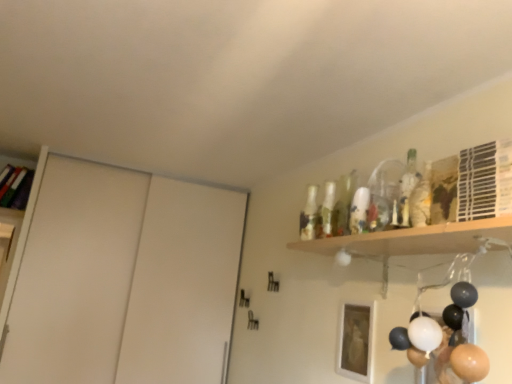
Describe the element at coordinates (485, 181) in the screenshot. I see `white plastic shelf at upper right, the second shelf in the back-to-front sequence` at that location.

From the picture: How much space does wooden bookshelf at upper left, which ranks as the second shelf in right-to-left order, occupy horizontally?

It is 12.65 inches.

What do you see at coordinates (16, 162) in the screenshot?
I see `wooden bookshelf at upper left, which ranks as the second shelf in right-to-left order` at bounding box center [16, 162].

The height and width of the screenshot is (384, 512). Find the location of `white matte sliding door at left`. white matte sliding door at left is located at coordinates (75, 275).

At what (x,y) coordinates should I click in order to perform the action: click on white matte picture frame at lower center. Please return your answer as a coordinate pair (x, y). This screenshot has width=512, height=384. Looking at the image, I should click on (356, 341).

At what (x,y) coordinates should I click in order to perform the action: click on white plastic shelf at upper right, which is the first shelf in right-to-left order. Please return your answer as a coordinate pair (x, y). Looking at the image, I should click on (485, 181).

From the image's perspective, is white matte picture frame at lower center below white matte sliding door at left?

Actually, white matte picture frame at lower center appears above white matte sliding door at left in the image.

How far apart are white matte picture frame at lower center and white matte sliding door at left?

white matte picture frame at lower center is 1.84 meters from white matte sliding door at left.

Considering the sizes of objects white matte picture frame at lower center and white matte sliding door at left in the image provided, who is wider, white matte picture frame at lower center or white matte sliding door at left?

With larger width is white matte sliding door at left.

Is white matte picture frame at lower center aimed at white matte sliding door at left?

Answer: No, white matte picture frame at lower center is not aimed at white matte sliding door at left.

From the image's perspective, does white matte sliding door at left appear lower than white matte picture frame at lower center?

Yes, from the image's perspective, white matte sliding door at left is below white matte picture frame at lower center.

Would you say white matte sliding door at left is inside or outside white matte picture frame at lower center?

white matte sliding door at left lies outside white matte picture frame at lower center.

Who is shorter, white matte sliding door at left or white matte picture frame at lower center?

With less height is white matte picture frame at lower center.

Considering the sizes of objects white matte sliding door at left and white matte picture frame at lower center in the image provided, who is smaller, white matte sliding door at left or white matte picture frame at lower center?

white matte picture frame at lower center is smaller.

From a real-world perspective, is wooden bookshelf at upper left, which ranks as the second shelf in right-to-left order, located higher than white plastic shelf at upper right, the second shelf in the back-to-front sequence?

Correct, in the physical world, wooden bookshelf at upper left, which ranks as the second shelf in right-to-left order, is higher than white plastic shelf at upper right, the second shelf in the back-to-front sequence.

Who is taller, wooden bookshelf at upper left, the 2th shelf viewed from the front, or white plastic shelf at upper right, which is the first shelf in right-to-left order?

wooden bookshelf at upper left, the 2th shelf viewed from the front, is taller.

Find the location of a particular element. Image resolution: width=512 pixels, height=384 pixels. shelf in front of the wooden bookshelf at upper left, positioned as the 1th shelf in back-to-front order is located at coordinates (485, 181).

Could you measure the distance between wooden bookshelf at upper left, positioned as the 1th shelf in back-to-front order, and white plastic shelf at upper right, the second shelf in the back-to-front sequence?

10.56 feet.

Locate an element on the screen. shelf below the wooden bookshelf at upper left, the 2th shelf viewed from the front (from a real-world perspective) is located at coordinates (485, 181).

Which object is closer to the camera, white plastic shelf at upper right, the second shelf in the back-to-front sequence, or wooden bookshelf at upper left, the 1th shelf viewed from the left?

white plastic shelf at upper right, the second shelf in the back-to-front sequence, is in front.

How much distance is there between white plastic shelf at upper right, which is counted as the 2th shelf, starting from the left, and wooden bookshelf at upper left, positioned as the 1th shelf in back-to-front order?

white plastic shelf at upper right, which is counted as the 2th shelf, starting from the left, is 10.56 feet from wooden bookshelf at upper left, positioned as the 1th shelf in back-to-front order.

Can wooden bookshelf at upper left, the 1th shelf viewed from the left, be found inside white plastic shelf at upper right, which is the first shelf in right-to-left order?

That's incorrect, wooden bookshelf at upper left, the 1th shelf viewed from the left, is not inside white plastic shelf at upper right, which is the first shelf in right-to-left order.

Measure the distance from white matte sliding door at left to matte black balloons at lower right.

They are 7.47 feet apart.

How many degrees apart are the facing directions of white matte sliding door at left and matte black balloons at lower right?

The angle between the facing direction of white matte sliding door at left and the facing direction of matte black balloons at lower right is 83.9 degrees.

Is white matte sliding door at left at the right side of matte black balloons at lower right?

No, white matte sliding door at left is not to the right of matte black balloons at lower right.

Considering the relative sizes of white matte sliding door at left and matte black balloons at lower right in the image provided, is white matte sliding door at left wider than matte black balloons at lower right?

Indeed, white matte sliding door at left has a greater width compared to matte black balloons at lower right.

From the image's perspective, is white plastic shelf at upper right, which is counted as the first shelf, starting from the front, positioned above or below matte black balloons at lower right?

white plastic shelf at upper right, which is counted as the first shelf, starting from the front, is above matte black balloons at lower right.

Between white plastic shelf at upper right, which is counted as the 2th shelf, starting from the left, and matte black balloons at lower right, which one has smaller width?

Thinner between the two is matte black balloons at lower right.

Which is farther, [508,145] or [467,362]?

The point [467,362] is farther from the camera.

Is white plastic shelf at upper right, the second shelf in the back-to-front sequence, aimed at matte black balloons at lower right?

No.

Is the surface of white matte picture frame at lower center in direct contact with wooden bookshelf at upper left, positioned as the 1th shelf in back-to-front order?

There is a gap between white matte picture frame at lower center and wooden bookshelf at upper left, positioned as the 1th shelf in back-to-front order.

Which is in front, white matte picture frame at lower center or wooden bookshelf at upper left, which ranks as the second shelf in right-to-left order?

white matte picture frame at lower center is more forward.

In the scene shown: From the image's perspective, is white matte picture frame at lower center beneath wooden bookshelf at upper left, positioned as the 1th shelf in back-to-front order?

Indeed, from the image's perspective, white matte picture frame at lower center is shown beneath wooden bookshelf at upper left, positioned as the 1th shelf in back-to-front order.

Which point is more forward, (349, 344) or (15, 166)?

Positioned in front is point (349, 344).

I want to click on door lying on the left of white matte picture frame at lower center, so click(75, 275).

Image resolution: width=512 pixels, height=384 pixels. Find the location of `door behind the white matte picture frame at lower center`. door behind the white matte picture frame at lower center is located at coordinates (75, 275).

Based on their spatial positions, is white matte sliding door at left or matte black balloons at lower right further from white matte picture frame at lower center?

white matte sliding door at left is positioned further to the anchor white matte picture frame at lower center.

From the image, which object appears to be nearer to white plastic shelf at upper right, which is counted as the first shelf, starting from the front, wooden bookshelf at upper left, which ranks as the second shelf in right-to-left order, or white matte sliding door at left?

white matte sliding door at left lies closer to white plastic shelf at upper right, which is counted as the first shelf, starting from the front, than the other object.

From the image, which object appears to be nearer to white matte sliding door at left, white plastic shelf at upper right, which is counted as the 2th shelf, starting from the left, or white matte picture frame at lower center?

white matte picture frame at lower center is positioned closer to the anchor white matte sliding door at left.

Based on their spatial positions, is wooden bookshelf at upper left, the 2th shelf viewed from the front, or matte black balloons at lower right closer to white matte picture frame at lower center?

Based on the image, matte black balloons at lower right appears to be nearer to white matte picture frame at lower center.

Looking at the image, which one is located further to white plastic shelf at upper right, the second shelf in the back-to-front sequence, matte black balloons at lower right or white matte picture frame at lower center?

Among the two, white matte picture frame at lower center is located further to white plastic shelf at upper right, the second shelf in the back-to-front sequence.

Based on their spatial positions, is white plastic shelf at upper right, the second shelf in the back-to-front sequence, or white matte sliding door at left closer to white matte picture frame at lower center?

Among the two, white plastic shelf at upper right, the second shelf in the back-to-front sequence, is located nearer to white matte picture frame at lower center.

Looking at the image, which one is located further to white matte sliding door at left, wooden bookshelf at upper left, the 1th shelf viewed from the left, or matte black balloons at lower right?

Based on the image, matte black balloons at lower right appears to be further to white matte sliding door at left.

Which object lies further to the anchor point matte black balloons at lower right, white matte picture frame at lower center or white matte sliding door at left?

The object further to matte black balloons at lower right is white matte sliding door at left.

Find the location of `picture frame located between white matte sliding door at left and white plastic shelf at upper right, which is counted as the 2th shelf, starting from the left, in the left-right direction`. picture frame located between white matte sliding door at left and white plastic shelf at upper right, which is counted as the 2th shelf, starting from the left, in the left-right direction is located at coordinates (356, 341).

Locate an element on the screen. picture frame between wooden bookshelf at upper left, positioned as the 1th shelf in back-to-front order, and white plastic shelf at upper right, which is counted as the first shelf, starting from the front, from left to right is located at coordinates (356, 341).

Where is `balloon positioned between white plastic shelf at upper right, which is counted as the 2th shelf, starting from the left, and white matte picture frame at lower center from near to far`? balloon positioned between white plastic shelf at upper right, which is counted as the 2th shelf, starting from the left, and white matte picture frame at lower center from near to far is located at coordinates (444, 338).

At what (x,y) coordinates should I click in order to perform the action: click on door between wooden bookshelf at upper left, positioned as the 1th shelf in back-to-front order, and matte black balloons at lower right, in the horizontal direction. Please return your answer as a coordinate pair (x, y). The image size is (512, 384). Looking at the image, I should click on (75, 275).